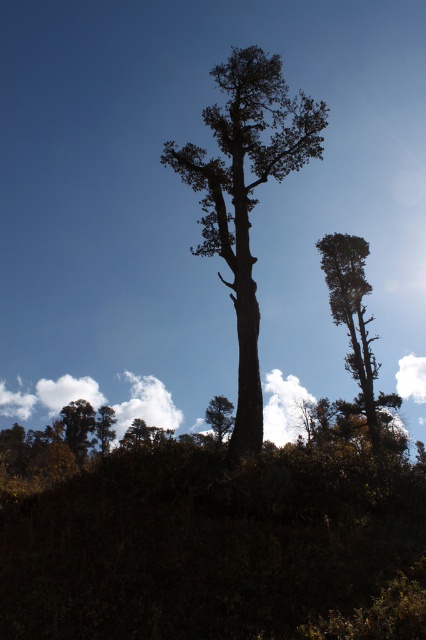
Consider the image. You are a bird looking for a nesting spot. You see the smooth brown tree at upper right and the green leafy tree at lower left. Which tree would provide a more stable nesting location based on their sizes?

The smooth brown tree at upper right has a larger size compared to the green leafy tree at lower left, so it would provide a more stable nesting location because larger trees typically have sturdier branches and more secure spots for nests.

You are standing in the natural landscape scene and want to place a small flag at each of the two points marked in the image. The first point is at coordinates point (206,490) and the second at point (287,172). Which point will require you to walk further away from your current position to reach?

Point (287,172) will require you to walk further away from your current position because it is farther from the camera compared to point (206,490), which is closer.